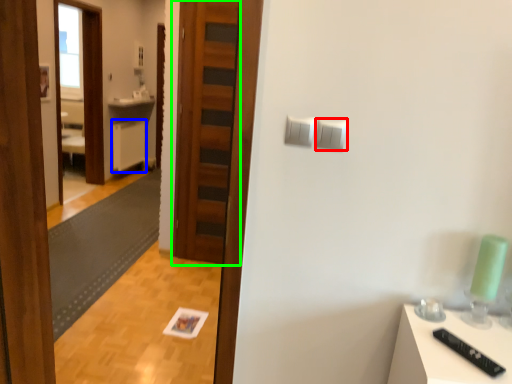
Question: Which object is the farthest from light switch (highlighted by a red box)? Choose among these: cabinetry (highlighted by a blue box) or door (highlighted by a green box).

Choices:
 (A) cabinetry
 (B) door

Answer: (A)